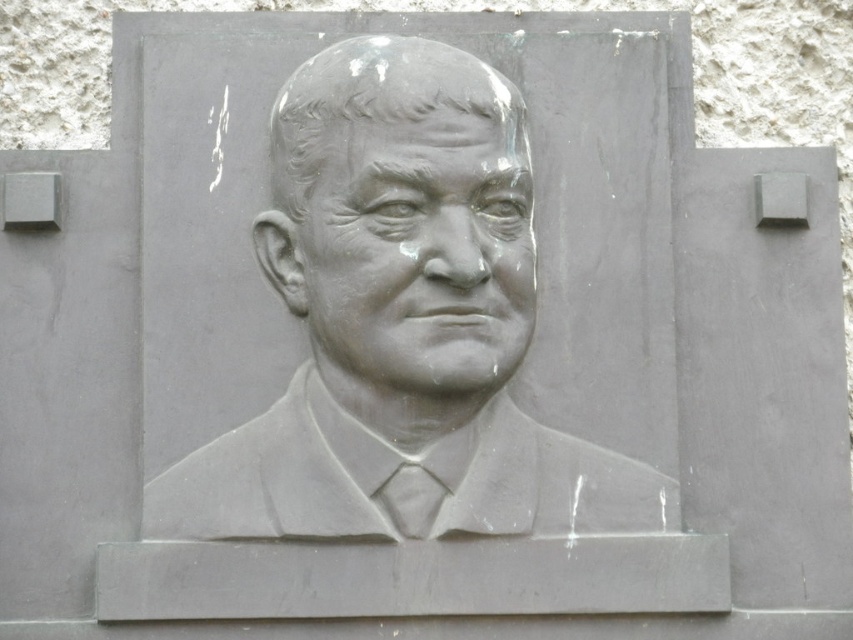
Based on the scene description, which object is taller between the gray stone relief at center and the gray stone face at center?

The gray stone relief at center is taller than the gray stone face at center.

You are an art conservator examining the sculpture. You notice that the gray stone relief at center and the gray stone face at center are positioned in a specific way. Which object is located to the right of the other?

The gray stone relief at center is to the right of the gray stone face at center.